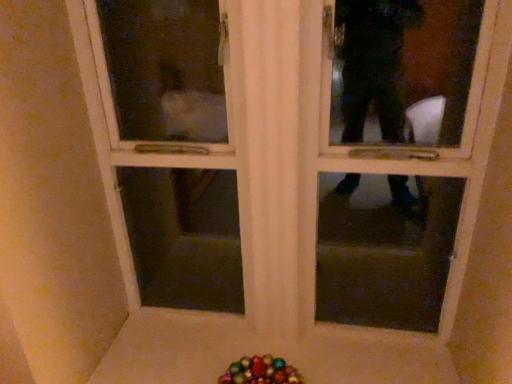
What are the coordinates of `free area behind multicolored glass beads at lower center` in the screenshot? It's located at (253, 347).